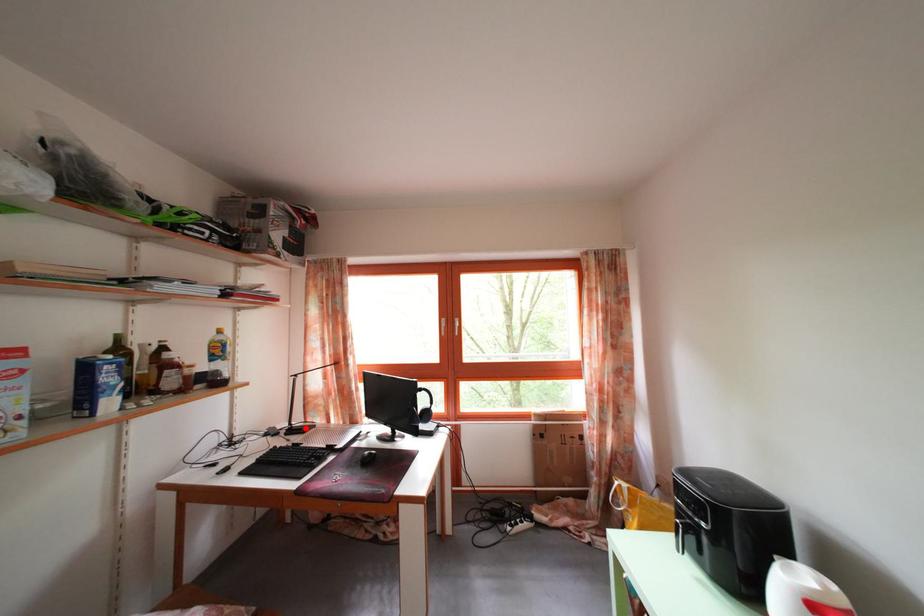
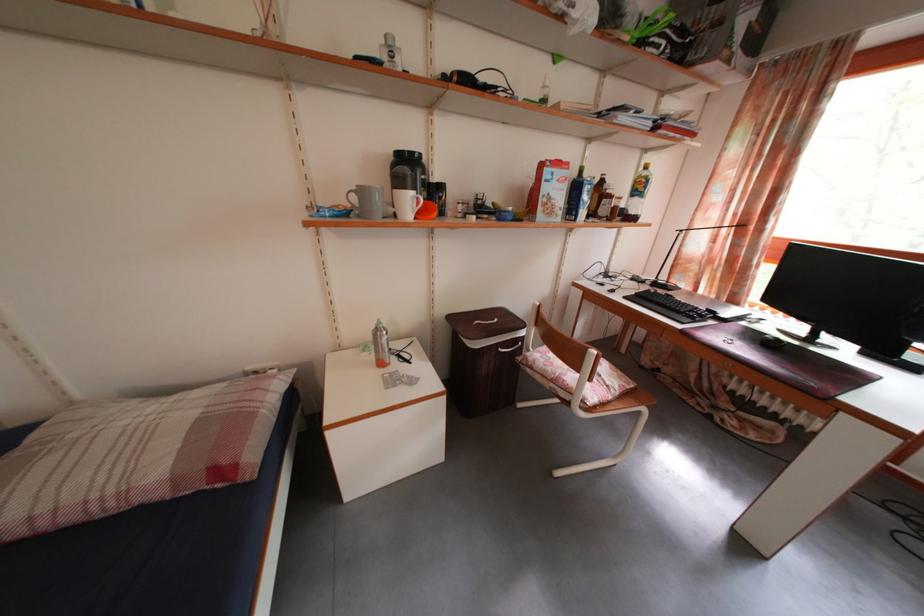
Question: A red point is marked in image1. In image2, is the corresponding 3D point closer to the camera or farther? Reply with the corresponding letter.

Choices:
 (A) The corresponding 3D point is closer.
 (B) The corresponding 3D point is farther.

Answer: (A)